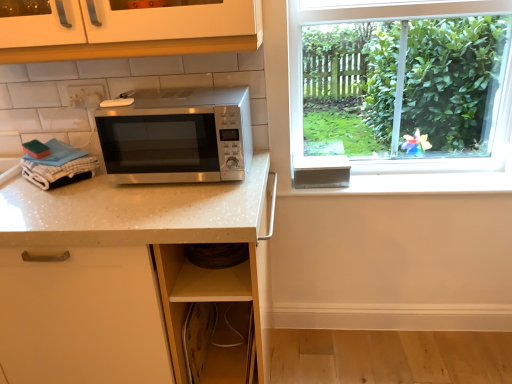
Question: In terms of width, does satin silver microwave at center look wider or thinner when compared to white plastic electric outlet at upper left?

Choices:
 (A) thin
 (B) wide

Answer: (B)

Question: From a real-world perspective, is satin silver microwave at center physically located above or below white plastic electric outlet at upper left?

Choices:
 (A) above
 (B) below

Answer: (B)

Question: Which object is positioned farthest from the white speckled quartz at center?

Choices:
 (A) white plastic electric outlet at upper left
 (B) satin silver microwave at center

Answer: (A)

Question: Estimate the real-world distances between objects in this image. Which object is closer to the white speckled quartz at center?

Choices:
 (A) satin silver microwave at center
 (B) white plastic electric outlet at upper left

Answer: (A)